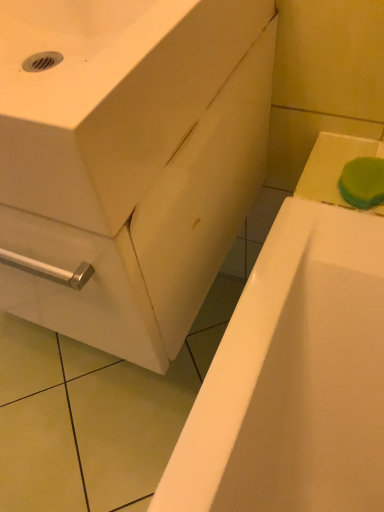
This screenshot has width=384, height=512. Describe the element at coordinates (109, 97) in the screenshot. I see `white glossy sink at center` at that location.

The width and height of the screenshot is (384, 512). What do you see at coordinates (363, 182) in the screenshot? I see `green sponge at upper right` at bounding box center [363, 182].

What is the approximate width of green sponge at upper right?

4.29 inches.

Identify the location of white glossy sink at center. Image resolution: width=384 pixels, height=512 pixels. (109, 97).

Considering the positions of objects white glossy bathtub at lower right and white glossy sink at center in the image provided, who is more to the left, white glossy bathtub at lower right or white glossy sink at center?

From the viewer's perspective, white glossy sink at center appears more on the left side.

Is point (291, 267) positioned behind point (78, 8)?

No, it is in front of (78, 8).

Is white glossy bathtub at lower right looking in the opposite direction of white glossy sink at center?

No, white glossy bathtub at lower right is not facing the opposite direction of white glossy sink at center.

Can you tell me how much white glossy bathtub at lower right and white glossy sink at center differ in facing direction?

white glossy bathtub at lower right and white glossy sink at center are facing 89.6 degrees away from each other.

Does white glossy sink at center have a lesser height compared to green sponge at upper right?

In fact, white glossy sink at center may be taller than green sponge at upper right.

From the image's perspective, is white glossy sink at center located above or below green sponge at upper right?

Based on their image positions, white glossy sink at center is located above green sponge at upper right.

Which is correct: white glossy sink at center is inside green sponge at upper right, or outside of it?

white glossy sink at center is not inside green sponge at upper right, it's outside.

This screenshot has height=512, width=384. Identify the location of soap behind the white glossy sink at center. (363, 182).

Is green sponge at upper right not within white glossy bathtub at lower right?

Yes, green sponge at upper right is not within white glossy bathtub at lower right.

Is green sponge at upper right turned away from white glossy bathtub at lower right?

Result: No, white glossy bathtub at lower right is not at the back of green sponge at upper right.

Between green sponge at upper right and white glossy bathtub at lower right, which one has smaller width?

green sponge at upper right is thinner.

Which is nearer, (343, 173) or (314, 237)?

Point (343, 173) appears to be farther away from the viewer than point (314, 237).

Would you say green sponge at upper right is a long distance from white glossy sink at center?

→ No.

Does green sponge at upper right have a lesser height compared to white glossy sink at center?

Correct, green sponge at upper right is not as tall as white glossy sink at center.

In terms of width, does green sponge at upper right look wider or thinner when compared to white glossy sink at center?

green sponge at upper right is thinner than white glossy sink at center.

How different are the orientations of white glossy sink at center and white glossy bathtub at lower right in degrees?

The facing directions of white glossy sink at center and white glossy bathtub at lower right are 89.6 degrees apart.

Which is correct: white glossy sink at center is inside white glossy bathtub at lower right, or outside of it?

white glossy sink at center is located beyond the bounds of white glossy bathtub at lower right.

Could you tell me if white glossy sink at center is turned towards white glossy bathtub at lower right?

No, white glossy sink at center is not aimed at white glossy bathtub at lower right.

Looking at their sizes, would you say white glossy sink at center is wider or thinner than white glossy bathtub at lower right?

white glossy sink at center is thinner than white glossy bathtub at lower right.

Is white glossy bathtub at lower right facing away from green sponge at upper right?

That's not correct — white glossy bathtub at lower right is not looking away from green sponge at upper right.

Relative to green sponge at upper right, is white glossy bathtub at lower right in front or behind?

Clearly, white glossy bathtub at lower right is behind green sponge at upper right.

From the image's perspective, is white glossy bathtub at lower right above or below green sponge at upper right?

Clearly, from the image's perspective, white glossy bathtub at lower right is below green sponge at upper right.

Would you consider white glossy bathtub at lower right to be distant from green sponge at upper right?

That's not correct — white glossy bathtub at lower right is a little close to green sponge at upper right.

There is a white glossy bathtub at lower right. Where is `sink above it (from a real-world perspective)`? sink above it (from a real-world perspective) is located at coordinates (109, 97).

Locate an element on the screen. This screenshot has width=384, height=512. soap below the white glossy sink at center (from the image's perspective) is located at coordinates (363, 182).

Consider the image. Which object lies further to the anchor point white glossy bathtub at lower right, white glossy sink at center or green sponge at upper right?

The object further to white glossy bathtub at lower right is white glossy sink at center.

From the image, which object appears to be farther from white glossy sink at center, white glossy bathtub at lower right or green sponge at upper right?

green sponge at upper right.

When comparing their distances from white glossy bathtub at lower right, does green sponge at upper right or white glossy sink at center seem further?

white glossy sink at center is further to white glossy bathtub at lower right.

Based on their spatial positions, is white glossy bathtub at lower right or white glossy sink at center closer to green sponge at upper right?

Based on the image, white glossy bathtub at lower right appears to be nearer to green sponge at upper right.

Based on their spatial positions, is white glossy sink at center or white glossy bathtub at lower right further from green sponge at upper right?

white glossy sink at center.

When comparing their distances from white glossy sink at center, does green sponge at upper right or white glossy bathtub at lower right seem closer?

Among the two, white glossy bathtub at lower right is located nearer to white glossy sink at center.

The image size is (384, 512). Identify the location of soap between white glossy sink at center and white glossy bathtub at lower right vertically. pos(363,182).